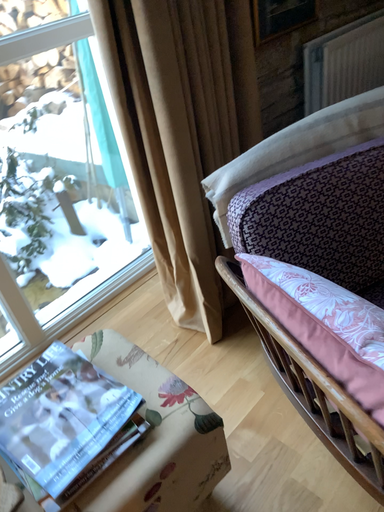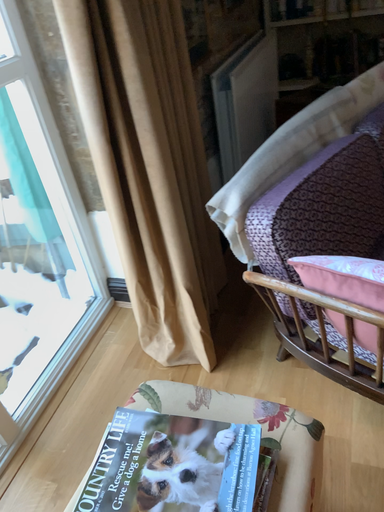
Question: How did the camera likely rotate when shooting the video?

Choices:
 (A) rotated left
 (B) rotated right

Answer: (B)